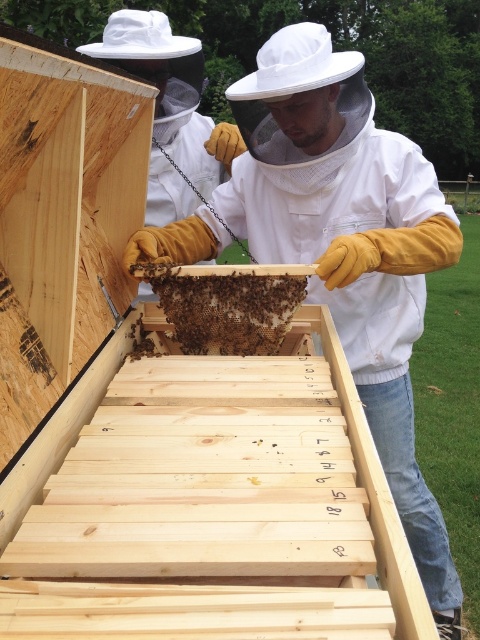
Question: Which object appears farthest from the camera in this image?

Choices:
 (A) brown honeycomb at center
 (B) white mesh veil at center

Answer: (A)

Question: Can you confirm if white mesh veil at center is wider than brown honeycomb at center?

Choices:
 (A) yes
 (B) no

Answer: (A)

Question: Which of the following is the farthest from the observer?

Choices:
 (A) (244, 342)
 (B) (371, 364)

Answer: (B)

Question: Is white mesh veil at center above brown honeycomb at center?

Choices:
 (A) no
 (B) yes

Answer: (A)

Question: Is white mesh veil at center to the right of brown honeycomb at center from the viewer's perspective?

Choices:
 (A) yes
 (B) no

Answer: (A)